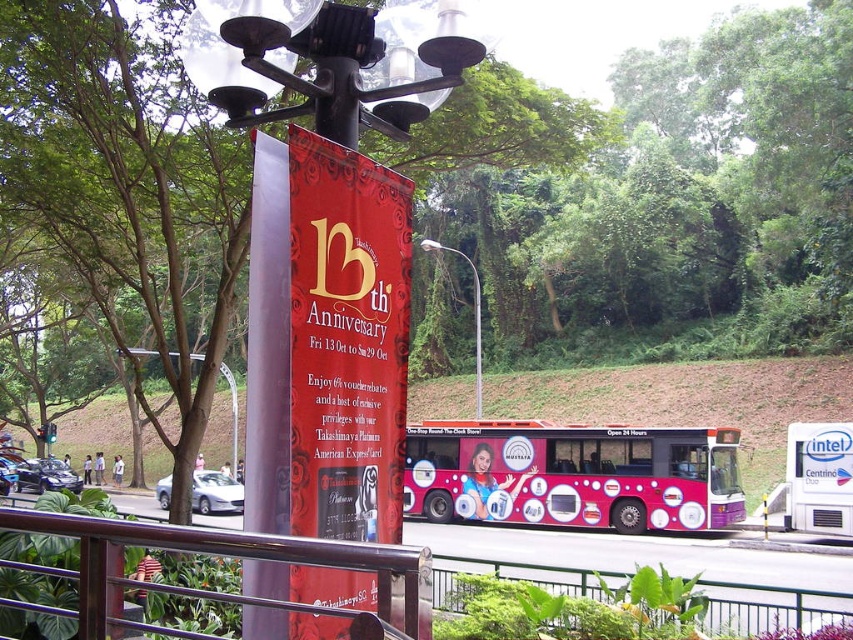
Question: Is metallic black lamp post at center to the right of metal at center from the viewer's perspective?

Choices:
 (A) no
 (B) yes

Answer: (B)

Question: Does metal at center appear under metallic silver streetlight at center?

Choices:
 (A) no
 (B) yes

Answer: (B)

Question: Does metallic black lamp post at center appear on the left side of metallic silver streetlight at center?

Choices:
 (A) no
 (B) yes

Answer: (B)

Question: Which of the following is the closest to the observer?

Choices:
 (A) pink glossy bus at center
 (B) shiny pink bus at center

Answer: (A)

Question: Which object appears closest to the camera in this image?

Choices:
 (A) metallic black lamp post at center
 (B) pink glossy bus at center
 (C) shiny pink bus at center
 (D) metal at center

Answer: (D)

Question: Estimate the real-world distances between objects in this image. Which object is farther from the metallic black lamp post at center?

Choices:
 (A) shiny pink bus at center
 (B) metallic silver streetlight at center
 (C) pink glossy bus at center

Answer: (B)